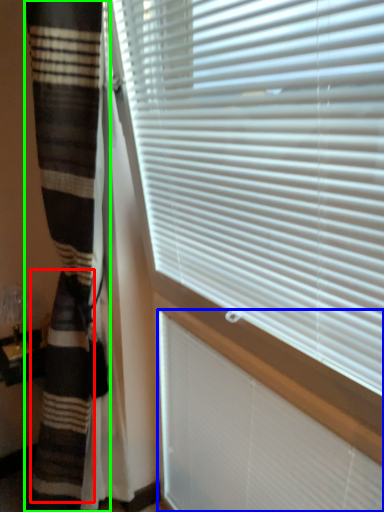
Question: Which is farther away from blanket (highlighted by a red box)? blind (highlighted by a blue box) or curtain (highlighted by a green box)?

Choices:
 (A) blind
 (B) curtain

Answer: (A)